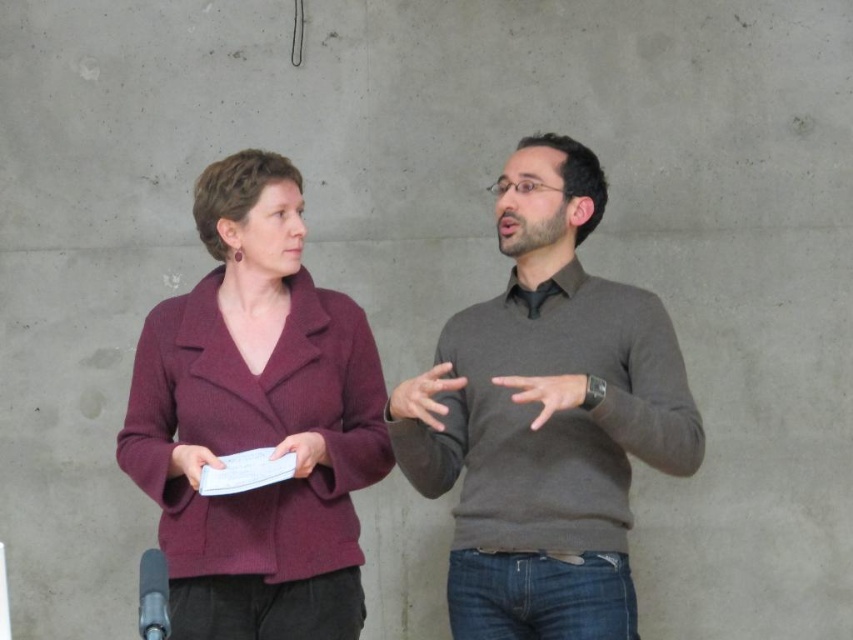
Is point (428, 433) positioned after point (440, 362)?

That is False.

Find the location of a particular element. matte gray sweater at center is located at coordinates (550, 419).

Locate an element on the screen. Image resolution: width=853 pixels, height=640 pixels. matte gray sweater at center is located at coordinates (550, 419).

Which is behind, point (312, 324) or point (187, 456)?

The point (312, 324) is more distant.

Who is positioned more to the right, burgundy woolen coat at left or white paper at lower left?

burgundy woolen coat at left is more to the right.

Locate an element on the screen. The image size is (853, 640). burgundy woolen coat at left is located at coordinates (257, 419).

Which is below, matte gray sweater at center or white paper at lower left?

Positioned lower is white paper at lower left.

Is point (486, 387) positioned in front of point (196, 486)?

No.

Locate an element on the screen. The width and height of the screenshot is (853, 640). matte gray sweater at center is located at coordinates (550, 419).